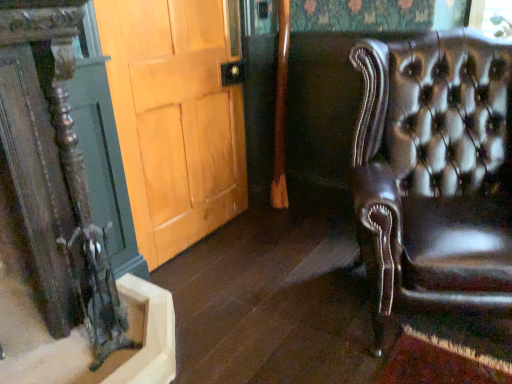
Question: Is light brown wood door at center not within brown leather chair at right?

Choices:
 (A) yes
 (B) no

Answer: (A)

Question: From a real-world perspective, does light brown wood door at center sit lower than brown leather chair at right?

Choices:
 (A) no
 (B) yes

Answer: (A)

Question: Can you confirm if light brown wood door at center is positioned to the right of brown leather chair at right?

Choices:
 (A) yes
 (B) no

Answer: (B)

Question: Is light brown wood door at center to the left of brown leather chair at right from the viewer's perspective?

Choices:
 (A) no
 (B) yes

Answer: (B)

Question: Is light brown wood door at center aimed at brown leather chair at right?

Choices:
 (A) no
 (B) yes

Answer: (B)

Question: Is light brown wood door at center positioned behind brown leather chair at right?

Choices:
 (A) yes
 (B) no

Answer: (A)

Question: From a real-world perspective, is brown leather chair at right positioned over light brown wood door at center based on gravity?

Choices:
 (A) no
 (B) yes

Answer: (A)

Question: From the image's perspective, is brown leather chair at right under light brown wood door at center?

Choices:
 (A) yes
 (B) no

Answer: (A)

Question: Can you confirm if brown leather chair at right is smaller than light brown wood door at center?

Choices:
 (A) no
 (B) yes

Answer: (A)

Question: Is brown leather chair at right shorter than light brown wood door at center?

Choices:
 (A) yes
 (B) no

Answer: (A)

Question: Does brown leather chair at right appear on the left side of light brown wood door at center?

Choices:
 (A) no
 (B) yes

Answer: (A)

Question: From a real-world perspective, is brown leather chair at right physically below light brown wood door at center?

Choices:
 (A) no
 (B) yes

Answer: (B)

Question: Looking at the image, does light brown wood door at center seem bigger or smaller compared to brown leather chair at right?

Choices:
 (A) small
 (B) big

Answer: (A)